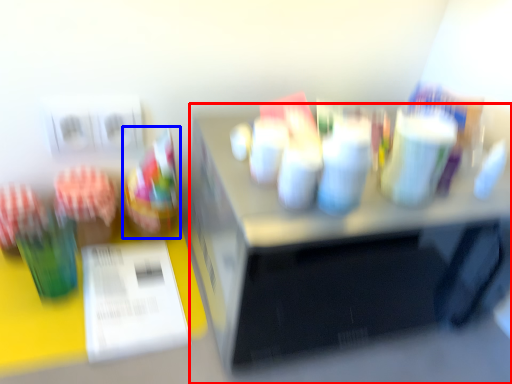
Question: Among these objects, which one is farthest to the camera, desk (highlighted by a red box) or food (highlighted by a blue box)?

Choices:
 (A) desk
 (B) food

Answer: (B)